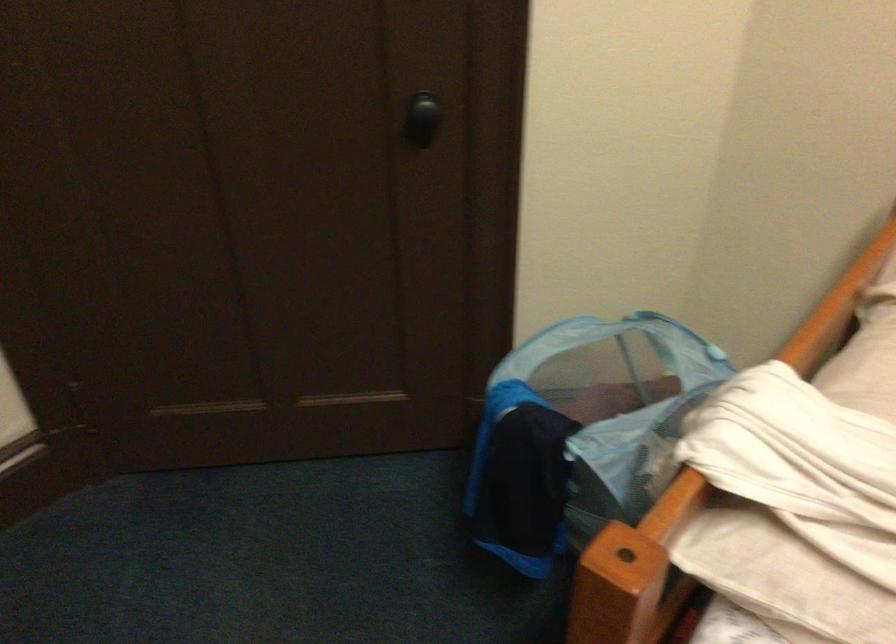
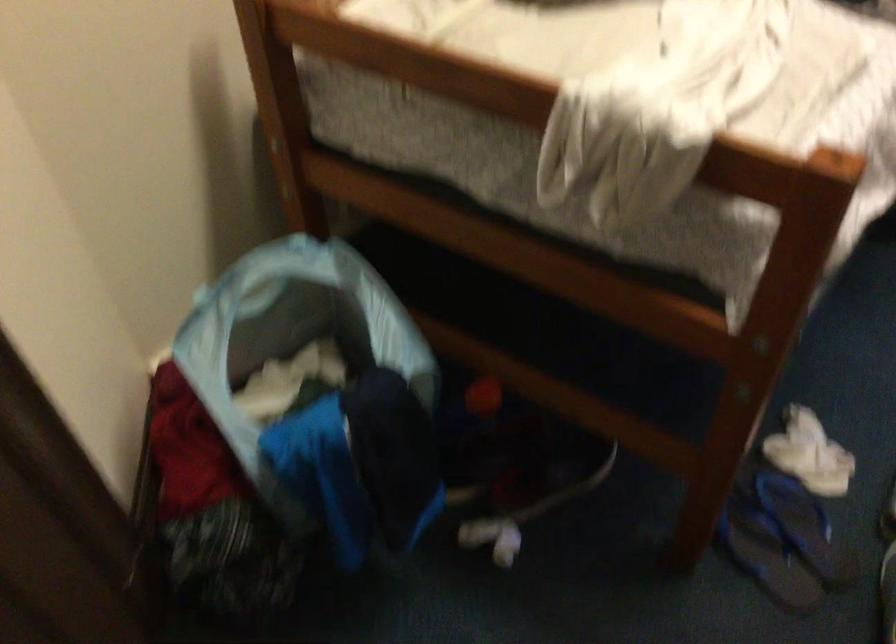
Based on the continuous images, in which direction is the camera rotating?

The rotation direction of the camera is right-down.